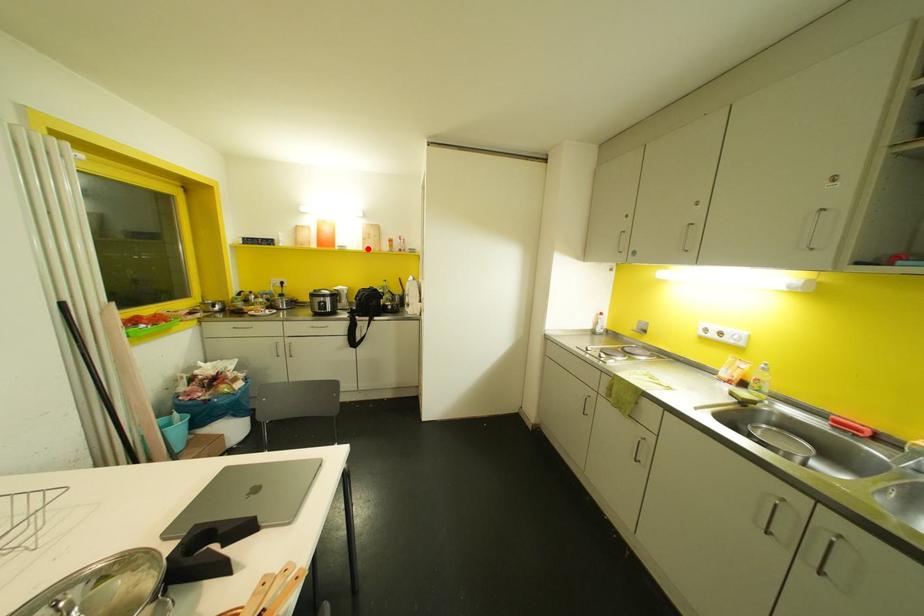
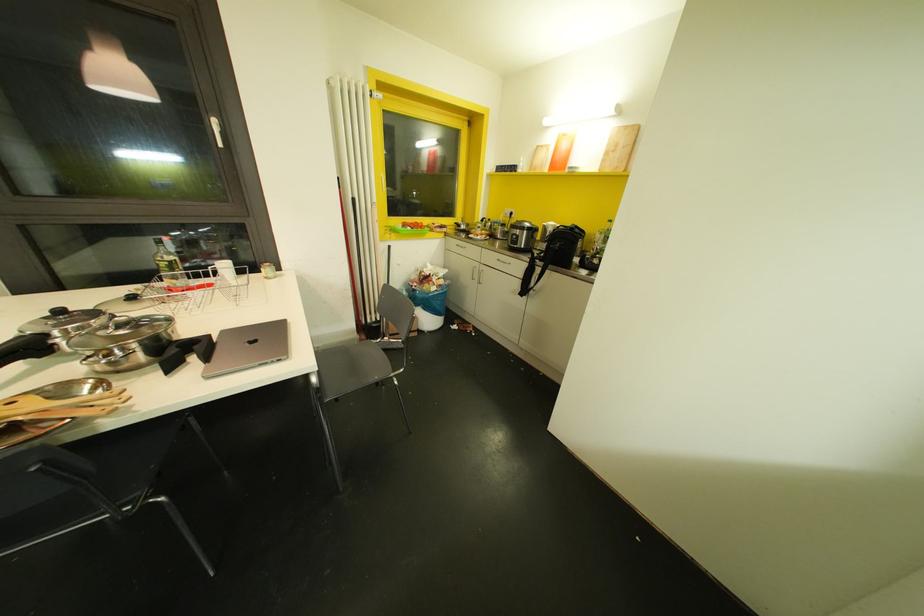
Where in the second image is the point corresponding to the highlighted location from the first image?

(606, 169)